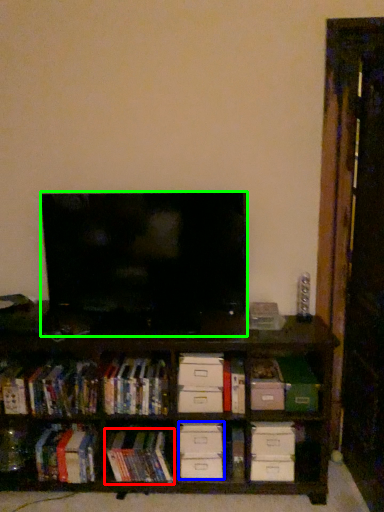
Question: Based on their relative distances, which object is nearer to book (highlighted by a red box)? Choose from drawer (highlighted by a blue box) and television (highlighted by a green box).

Choices:
 (A) drawer
 (B) television

Answer: (A)